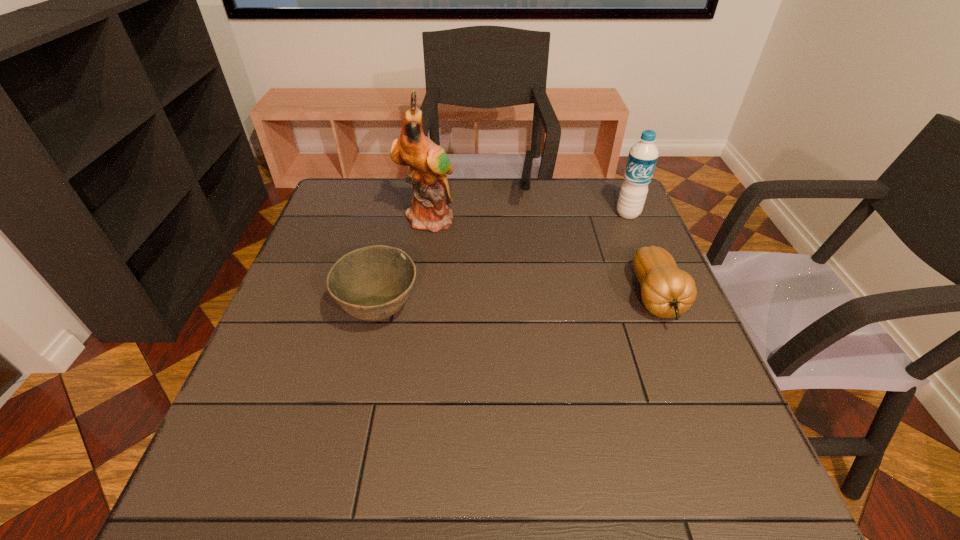
You are a GUI agent. You are given a task and a screenshot of the screen. Output one action in this format:
    pyautogui.click(x=<x>, y=<y>)
    Task: Click on the bowl
    Image resolution: width=960 pixels, height=540 pixels.
    Given the screenshot: What is the action you would take?
    pyautogui.click(x=372, y=283)

Identify the location of gourd. (666, 291).

Where is `pistol`? The width and height of the screenshot is (960, 540). pistol is located at coordinates (525, 182).

The width and height of the screenshot is (960, 540). In order to click on parrot in this screenshot , I will do `click(429, 164)`.

Find the location of a particular element. The image size is (960, 540). the fourth shortest object is located at coordinates (643, 156).

Where is `vacant space located on the back of the bowl`? This screenshot has width=960, height=540. vacant space located on the back of the bowl is located at coordinates (403, 207).

You are a GUI agent. You are given a task and a screenshot of the screen. Output one action in this format:
    pyautogui.click(x=<x>, y=<y>)
    Task: Click on the free region located on the stem side of the gourd
    The height and width of the screenshot is (540, 960).
    Given the screenshot: What is the action you would take?
    pyautogui.click(x=680, y=358)

Where is `vacant space located on the front-facing side of the pistol`? The width and height of the screenshot is (960, 540). vacant space located on the front-facing side of the pistol is located at coordinates (522, 236).

You are a GUI agent. You are given a task and a screenshot of the screen. Output one action in this format:
    pyautogui.click(x=<x>, y=<y>)
    Task: Click on the blank space located 0.400m on the front-facing side of the pistol
    The width and height of the screenshot is (960, 540).
    Given the screenshot: What is the action you would take?
    pyautogui.click(x=510, y=316)

Locate an element on the screen. vacant space located 0.130m on the front-facing side of the pistol is located at coordinates (521, 242).